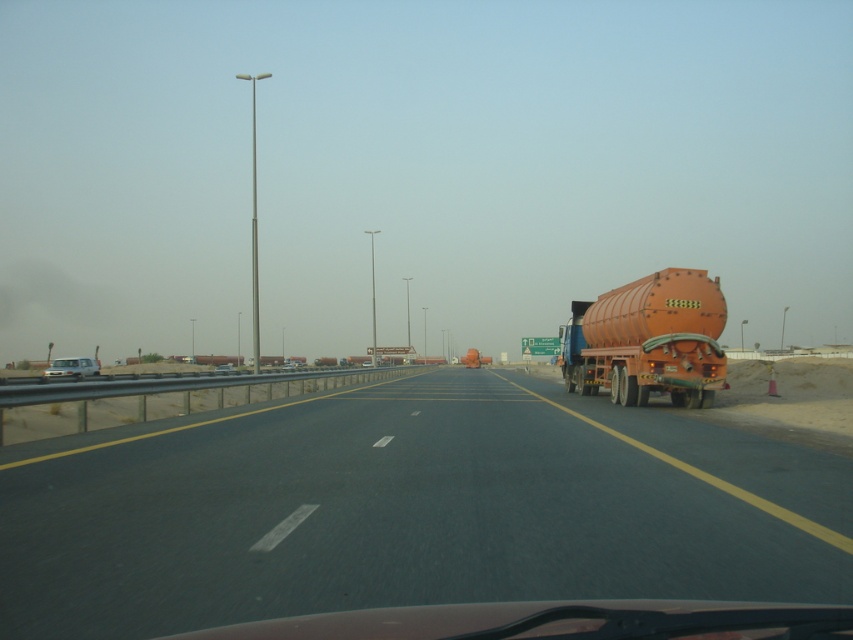
Question: Can you confirm if orange matte tanker at right is positioned to the left of white matte van at left?

Choices:
 (A) no
 (B) yes

Answer: (A)

Question: Does asphalt road at center come in front of white matte van at left?

Choices:
 (A) no
 (B) yes

Answer: (B)

Question: Can you confirm if white matte van at left is bigger than matte silver sedan at center?

Choices:
 (A) no
 (B) yes

Answer: (B)

Question: Which of the following is the farthest from the observer?

Choices:
 (A) orange matte tanker at right
 (B) white matte van at left
 (C) matte silver sedan at center
 (D) asphalt road at center

Answer: (C)

Question: Which point is farther from the camera taking this photo?

Choices:
 (A) click(x=73, y=356)
 (B) click(x=689, y=285)
 (C) click(x=167, y=524)
 (D) click(x=219, y=368)

Answer: (A)

Question: Among these objects, which one is farthest from the camera?

Choices:
 (A) white matte van at left
 (B) asphalt road at center
 (C) orange matte tanker at right
 (D) matte silver sedan at center

Answer: (D)